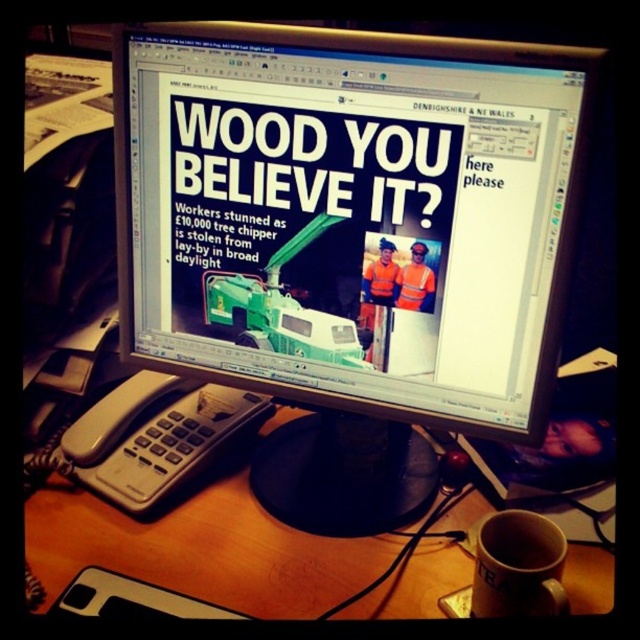
You are a delivery person who needs to place a large package on the desk. The package is too big to fit next to both the matte plastic monitor at center and the reflective orange vest at center. Which item should you move to make space?

The matte plastic monitor at center is larger in size than reflective orange vest at center, so you should move the reflective orange vest at center to make space for the large package.

You are a technician trying to locate the matte plastic monitor at center. According to the coordinates provided, where exactly is it positioned on the desk?

The matte plastic monitor at center is located at point (x=348, y=211) on the desk.

You are a delivery person who needs to place a reflective orange vest at center on the desk next to the matte plastic monitor at center. Given that the desk has limited space, can you fit the vest next to the monitor without overlapping?

The matte plastic monitor at center is wider than the reflective orange vest at center, so there should be enough space to place the vest next to the monitor without overlapping, as the monitor takes up more width than the vest.